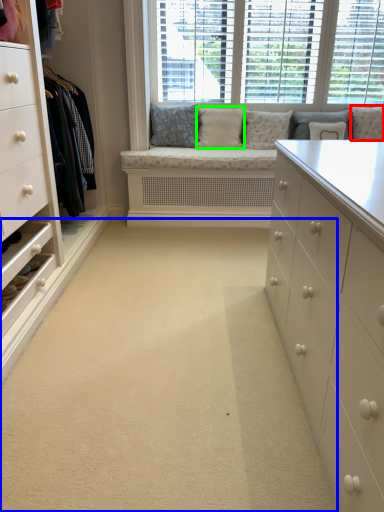
Question: Estimate the real-world distances between objects in this image. Which object is farther from pillow (highlighted by a red box), plain (highlighted by a blue box) or pillow (highlighted by a green box)?

Choices:
 (A) plain
 (B) pillow

Answer: (A)